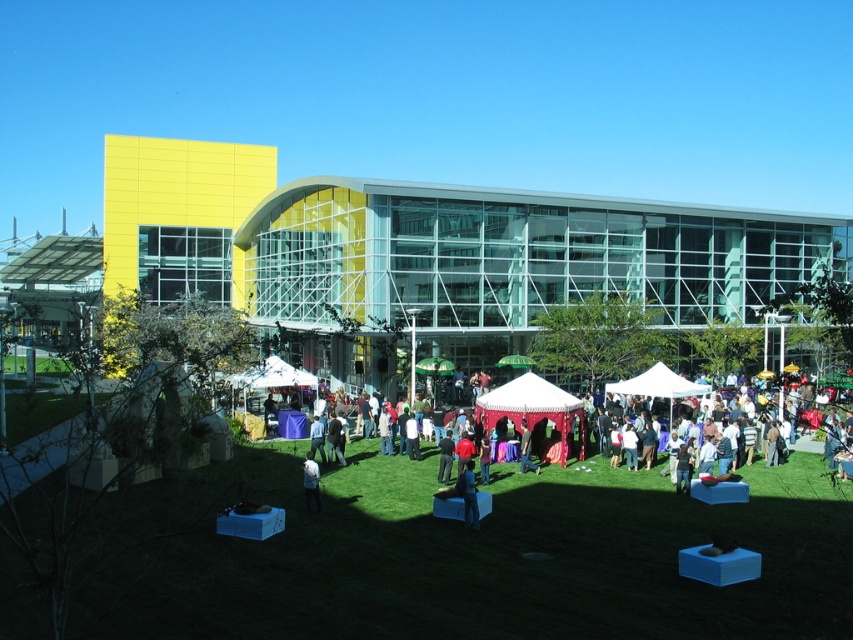
Does point (531, 403) lie in front of point (440, 451)?

No, it is not.

Is the position of red fabric tent at center more distant than that of black fabric at center?

Yes.

Which is in front, point (566, 406) or point (440, 461)?

Positioned in front is point (440, 461).

Locate an element on the screen. Image resolution: width=853 pixels, height=640 pixels. red fabric tent at center is located at coordinates (532, 406).

Can you confirm if red fabric tent at center is shorter than white fabric at center?

No, red fabric tent at center is not shorter than white fabric at center.

Does point (566, 422) lie behind point (306, 483)?

Yes, point (566, 422) is farther from viewer.

You are a GUI agent. You are given a task and a screenshot of the screen. Output one action in this format:
    pyautogui.click(x=<x>, y=<y>)
    Task: Click on the red fabric tent at center
    This screenshot has height=640, width=853.
    Given the screenshot: What is the action you would take?
    pyautogui.click(x=532, y=406)

Does dark blue shirt at center have a smaller size compared to white fabric at center?

Actually, dark blue shirt at center might be larger than white fabric at center.

Is dark blue shirt at center to the left of white fabric at center from the viewer's perspective?

No, dark blue shirt at center is not to the left of white fabric at center.

Locate an element on the screen. The width and height of the screenshot is (853, 640). dark blue shirt at center is located at coordinates (468, 496).